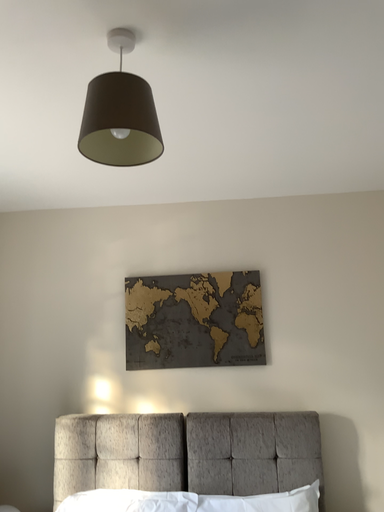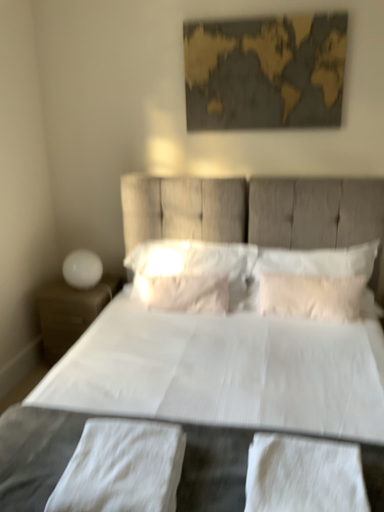
Question: How did the camera likely rotate when shooting the video?

Choices:
 (A) rotated downward
 (B) rotated upward

Answer: (A)